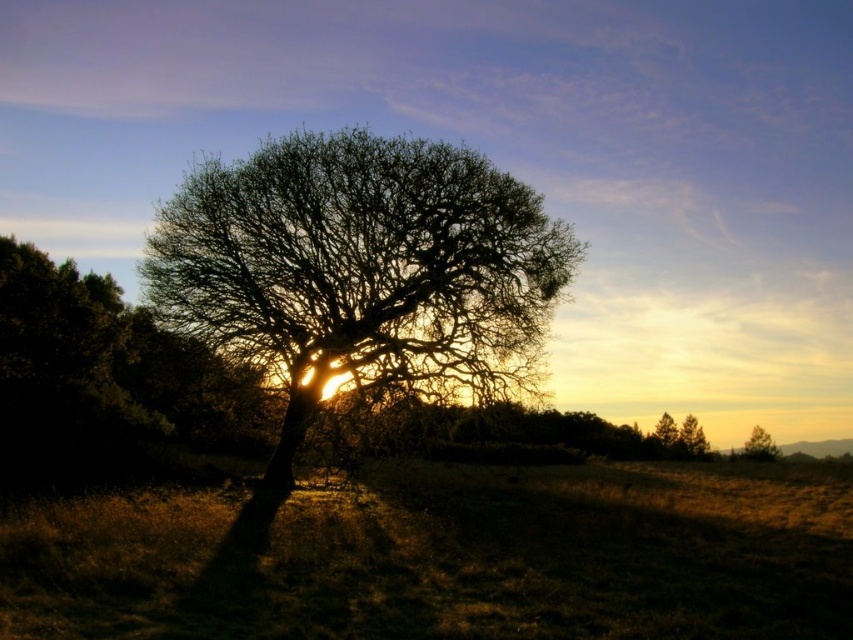
Question: Is green matte tree at upper right wider than green matte tree at right?

Choices:
 (A) no
 (B) yes

Answer: (B)

Question: From the image, what is the correct spatial relationship of green matte tree at upper right in relation to green matte tree at lower right?

Choices:
 (A) right
 (B) left

Answer: (B)

Question: Which of the following is the closest to the observer?

Choices:
 (A) silhouette leafy tree at center
 (B) green matte tree at lower right
 (C) brown grass at center

Answer: (C)

Question: Which is nearer to the silhouette leafy tree at center?

Choices:
 (A) brown grass at center
 (B) green matte tree at right
 (C) green matte tree at upper right
 (D) green matte tree at lower right

Answer: (A)

Question: Which of the following is the closest to the observer?

Choices:
 (A) green matte tree at upper right
 (B) brown grass at center
 (C) silhouette leafy tree at center
 (D) green matte tree at right

Answer: (B)

Question: Is brown grass at center to the right of green matte tree at right from the viewer's perspective?

Choices:
 (A) no
 (B) yes

Answer: (A)